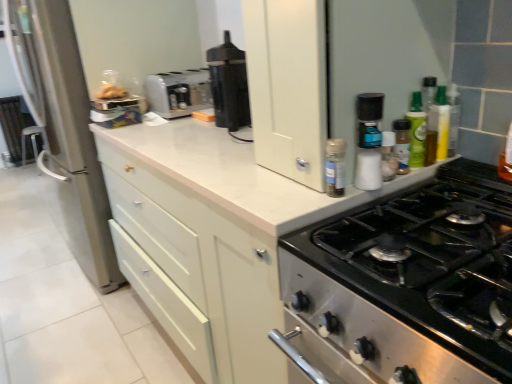
Question: From a real-world perspective, is white plastic salt shaker at upper right, marked as the 1th bottle in a left-to-right arrangement, positioned under white matte cabinet at upper center based on gravity?

Choices:
 (A) yes
 (B) no

Answer: (B)

Question: Can you confirm if white plastic salt shaker at upper right, marked as the 1th bottle in a left-to-right arrangement, is smaller than white matte cabinet at upper center?

Choices:
 (A) no
 (B) yes

Answer: (B)

Question: Is white plastic salt shaker at upper right, marked as the 1th bottle in a left-to-right arrangement, positioned beyond the bounds of white matte cabinet at upper center?

Choices:
 (A) no
 (B) yes

Answer: (B)

Question: Is there a large distance between white plastic salt shaker at upper right, marked as the 1th bottle in a left-to-right arrangement, and white matte cabinet at upper center?

Choices:
 (A) no
 (B) yes

Answer: (A)

Question: From the image's perspective, would you say white plastic salt shaker at upper right, the 4th bottle when ordered from right to left, is shown under white matte cabinet at upper center?

Choices:
 (A) yes
 (B) no

Answer: (B)

Question: Would you say white plastic spice rack at upper right is inside or outside matte silver refrigerator at left?

Choices:
 (A) inside
 (B) outside

Answer: (B)

Question: Would you say white plastic spice rack at upper right is to the left or to the right of matte silver refrigerator at left in the picture?

Choices:
 (A) left
 (B) right

Answer: (B)

Question: In the image, is white plastic spice rack at upper right positioned in front of or behind matte silver refrigerator at left?

Choices:
 (A) front
 (B) behind

Answer: (A)

Question: In terms of size, does white plastic spice rack at upper right appear bigger or smaller than matte silver refrigerator at left?

Choices:
 (A) big
 (B) small

Answer: (B)

Question: In terms of height, does green glass bottle at upper right, which appears as the 4th bottle when viewed from the left, look taller or shorter compared to white plastic salt shaker at upper right, the 4th bottle when ordered from right to left?

Choices:
 (A) tall
 (B) short

Answer: (A)

Question: From a real-world perspective, is green glass bottle at upper right, acting as the 1th bottle starting from the right, above or below white plastic salt shaker at upper right, the 4th bottle when ordered from right to left?

Choices:
 (A) above
 (B) below

Answer: (A)

Question: Is green glass bottle at upper right, acting as the 1th bottle starting from the right, inside or outside of white plastic salt shaker at upper right, the 4th bottle when ordered from right to left?

Choices:
 (A) outside
 (B) inside

Answer: (A)

Question: Is green glass bottle at upper right, acting as the 1th bottle starting from the right, bigger or smaller than white plastic salt shaker at upper right, the 4th bottle when ordered from right to left?

Choices:
 (A) small
 (B) big

Answer: (B)

Question: Considering the positions of point (387, 155) and point (359, 127), is point (387, 155) closer or farther from the camera than point (359, 127)?

Choices:
 (A) closer
 (B) farther

Answer: (B)

Question: Visually, is white plastic salt shaker at upper right, positioned as the 3th bottle in right-to-left order, positioned to the left or to the right of white plastic salt shaker at upper right, the 4th bottle when ordered from right to left?

Choices:
 (A) left
 (B) right

Answer: (B)